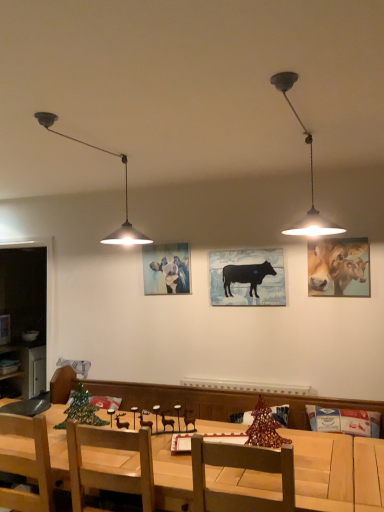
Question: From a real-world perspective, is wooden table at center beneath metallic pendant light at left, which ranks as the 2th lamp in right-to-left order?

Choices:
 (A) yes
 (B) no

Answer: (A)

Question: Can you confirm if wooden table at center is bigger than metallic pendant light at left, which ranks as the 2th lamp in right-to-left order?

Choices:
 (A) no
 (B) yes

Answer: (B)

Question: Considering the relative positions of wooden table at center and metallic pendant light at left, marked as the 1th lamp in a left-to-right arrangement, in the image provided, is wooden table at center to the left of metallic pendant light at left, marked as the 1th lamp in a left-to-right arrangement, from the viewer's perspective?

Choices:
 (A) yes
 (B) no

Answer: (B)

Question: Is the surface of wooden table at center in direct contact with metallic pendant light at left, which ranks as the 2th lamp in right-to-left order?

Choices:
 (A) yes
 (B) no

Answer: (B)

Question: Is wooden table at center further to camera compared to metallic pendant light at left, marked as the 1th lamp in a left-to-right arrangement?

Choices:
 (A) yes
 (B) no

Answer: (B)

Question: From the image's perspective, does wooden table at center appear lower than metallic pendant light at left, which ranks as the 2th lamp in right-to-left order?

Choices:
 (A) yes
 (B) no

Answer: (A)

Question: Does golden glossy cattle at upper right, marked as the 2th cattle in a left-to-right arrangement, come behind metallic silver cabinet at left?

Choices:
 (A) yes
 (B) no

Answer: (A)

Question: From the image's perspective, does golden glossy cattle at upper right, positioned as the first cattle in front-to-back order, appear lower than metallic silver cabinet at left?

Choices:
 (A) no
 (B) yes

Answer: (A)

Question: Is golden glossy cattle at upper right, positioned as the first cattle in front-to-back order, at the left side of metallic silver cabinet at left?

Choices:
 (A) yes
 (B) no

Answer: (B)

Question: Is golden glossy cattle at upper right, positioned as the first cattle in front-to-back order, next to metallic silver cabinet at left and touching it?

Choices:
 (A) no
 (B) yes

Answer: (A)

Question: Could you tell me if golden glossy cattle at upper right, marked as the 2th cattle in a left-to-right arrangement, is facing metallic silver cabinet at left?

Choices:
 (A) yes
 (B) no

Answer: (B)

Question: Considering the relative sizes of golden glossy cattle at upper right, marked as the 2th cattle in a left-to-right arrangement, and metallic silver cabinet at left in the image provided, is golden glossy cattle at upper right, marked as the 2th cattle in a left-to-right arrangement, taller than metallic silver cabinet at left?

Choices:
 (A) yes
 (B) no

Answer: (B)

Question: Is the depth of golden glossy cattle at upper right, the first cattle in the right-to-left sequence, greater than that of pastel blue painting of cattle at center, the 1th cattle from the back?

Choices:
 (A) no
 (B) yes

Answer: (A)